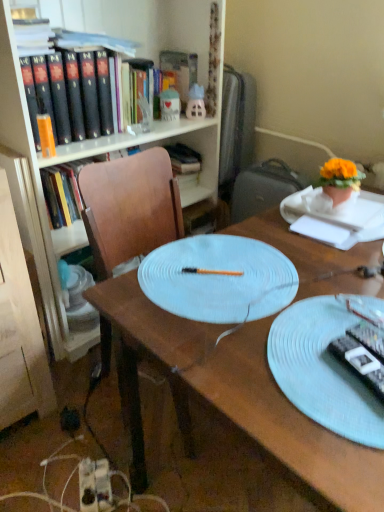
Locate an element on the screen. unoccupied space behind black plastic remote control at lower right, which appears as the second remote control when viewed from the right is located at coordinates (323, 312).